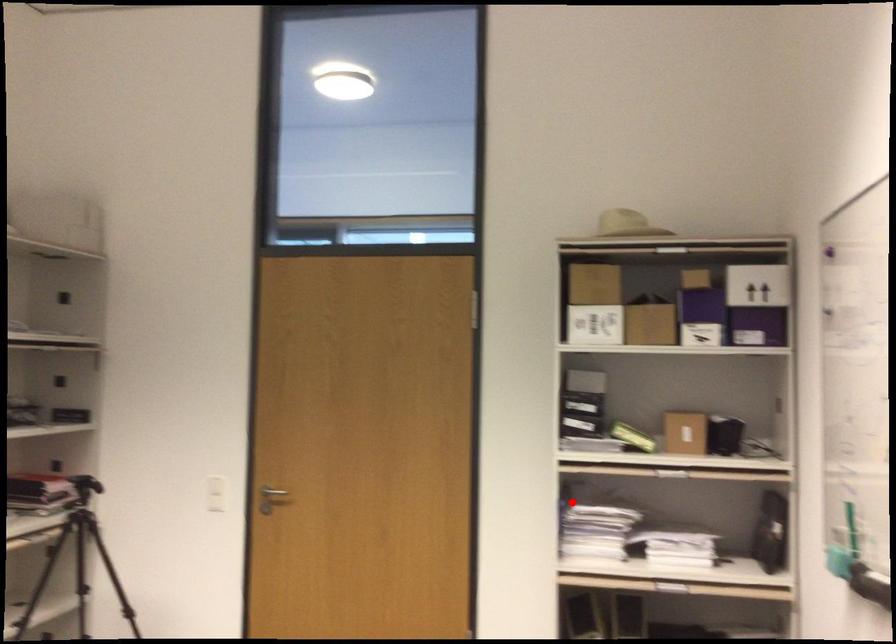
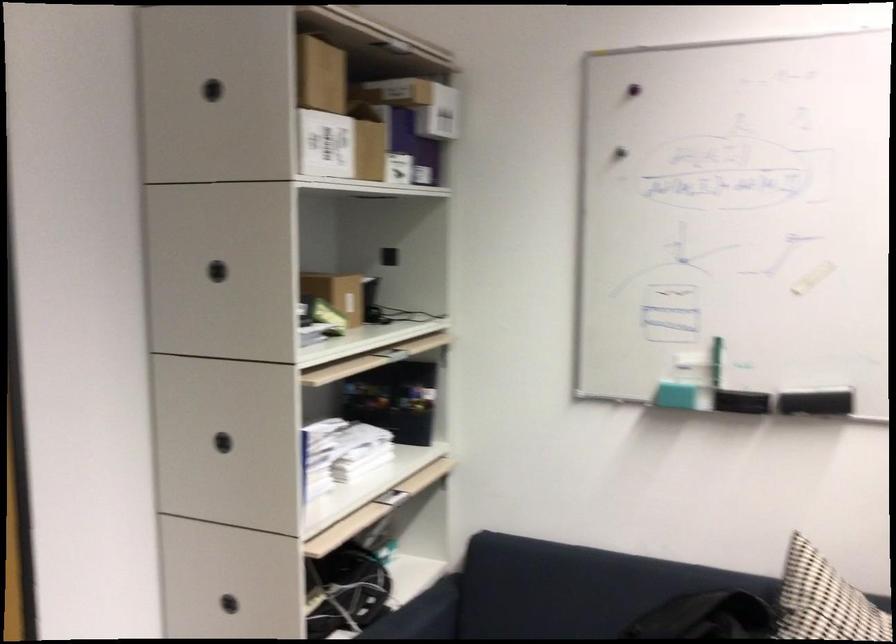
Question: I am providing you with two images of the same scene from different viewpoints. A red point is shown in image1. For the corresponding object point in image2, is it positioned nearer or farther from the camera?

Choices:
 (A) Nearer
 (B) Farther

Answer: (A)